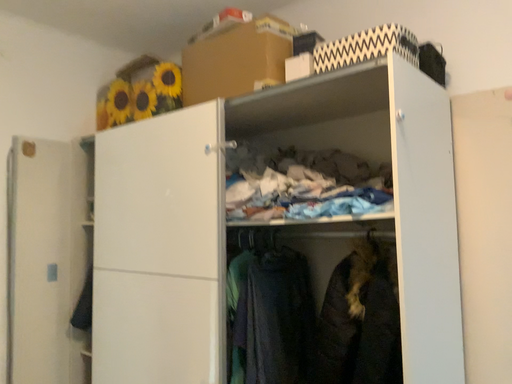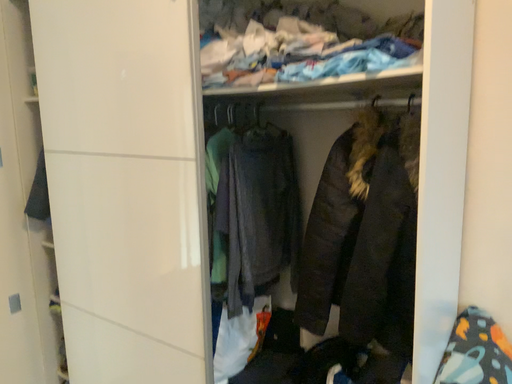
Question: How did the camera likely rotate when shooting the video?

Choices:
 (A) rotated upward
 (B) rotated downward

Answer: (B)